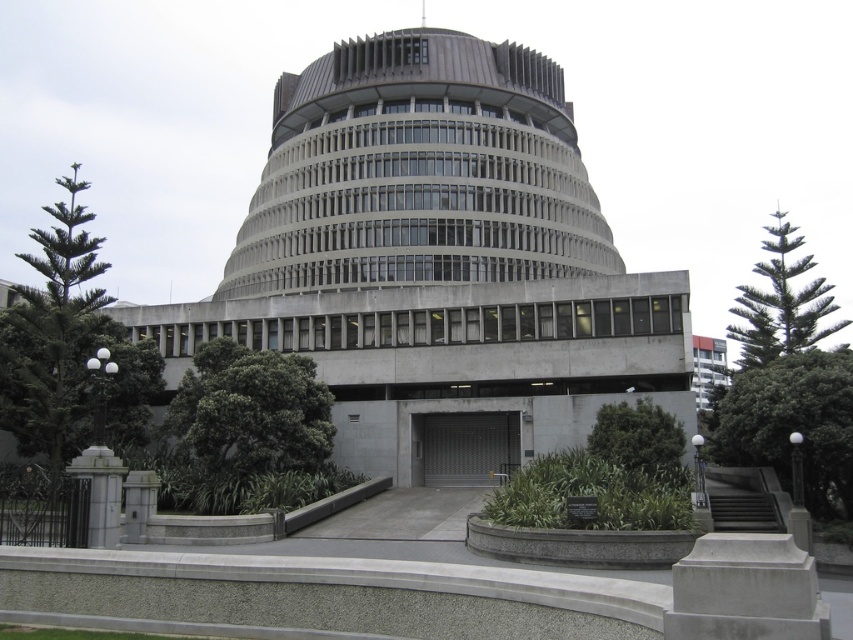
Which is in front, point (61, 364) or point (590, 440)?

Point (590, 440) is more forward.

Image resolution: width=853 pixels, height=640 pixels. What do you see at coordinates (68, 348) in the screenshot?
I see `green leafy tree at left` at bounding box center [68, 348].

Measure the distance between point (48, 451) and camera.

53.42 meters

The height and width of the screenshot is (640, 853). I want to click on green leafy tree at left, so click(68, 348).

Does green leafy bush at center appear on the right side of green textured pine tree at upper right?

In fact, green leafy bush at center is to the left of green textured pine tree at upper right.

Is green leafy bush at center wider than green textured pine tree at upper right?

No, green leafy bush at center is not wider than green textured pine tree at upper right.

Who is more forward, (256, 454) or (762, 353)?

Point (256, 454)

Where is `green leafy bush at center`? The width and height of the screenshot is (853, 640). green leafy bush at center is located at coordinates (247, 433).

Does green leafy bush at center have a larger size compared to green leafy tree at center?

Indeed, green leafy bush at center has a larger size compared to green leafy tree at center.

Is green leafy bush at center shorter than green leafy tree at center?

No.

Image resolution: width=853 pixels, height=640 pixels. I want to click on green leafy bush at center, so click(247, 433).

The width and height of the screenshot is (853, 640). Find the location of `green leafy bush at center`. green leafy bush at center is located at coordinates coord(247,433).